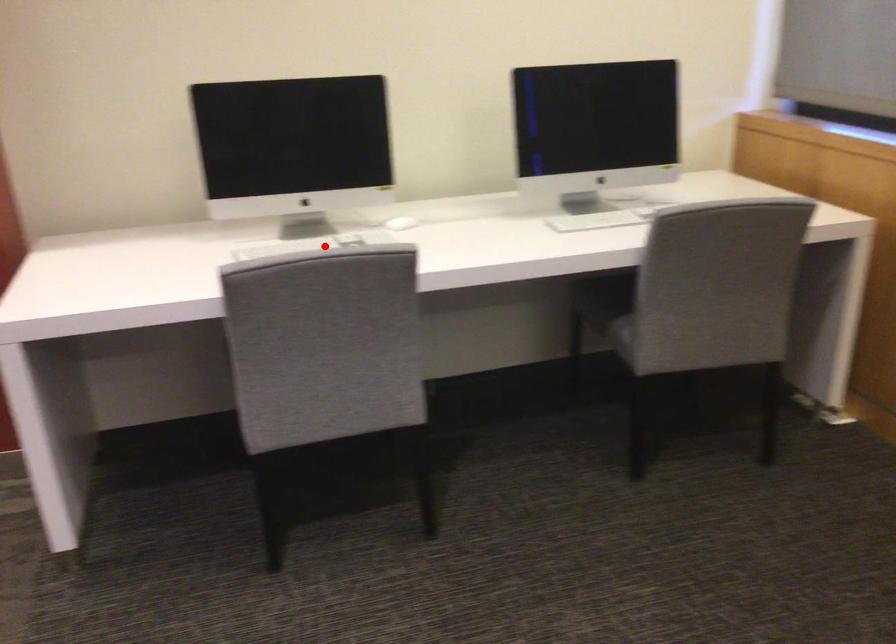
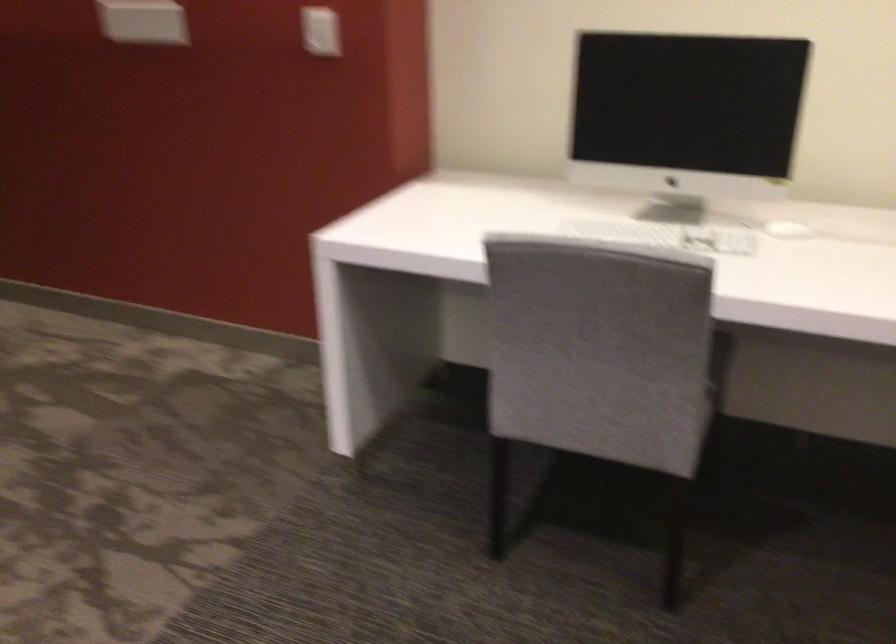
Find the pixel in the second image that matches the highlighted location in the first image.

(666, 234)